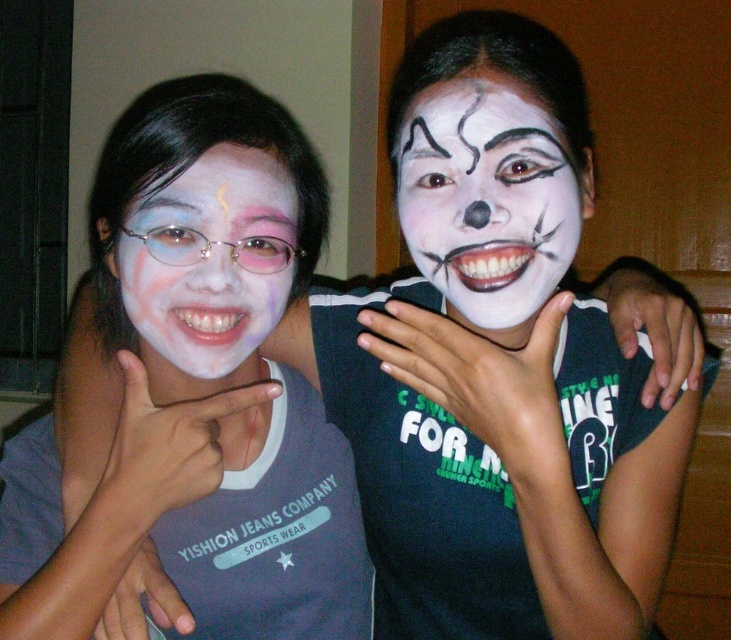
Question: Does white matte face paint at center come in front of matte white face at left?

Choices:
 (A) yes
 (B) no

Answer: (A)

Question: Which object is farther from the camera taking this photo?

Choices:
 (A) matte white face at left
 (B) white matte face paint at center

Answer: (A)

Question: Can you confirm if white matte face paint at center is bigger than matte white face at left?

Choices:
 (A) yes
 (B) no

Answer: (A)

Question: Is white matte face paint at center wider than matte white face at left?

Choices:
 (A) no
 (B) yes

Answer: (B)

Question: Which point is closer to the camera?

Choices:
 (A) (234, 172)
 (B) (518, 275)

Answer: (B)